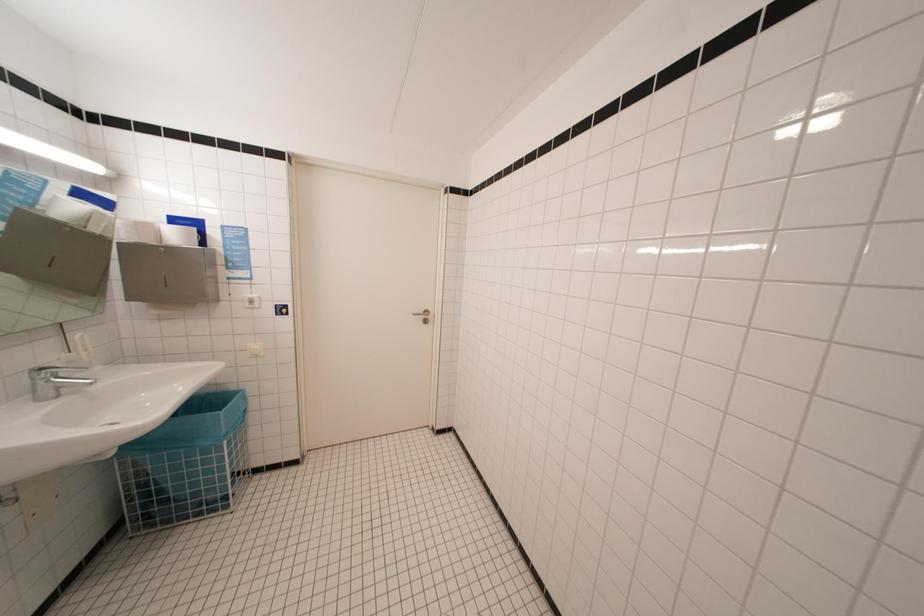
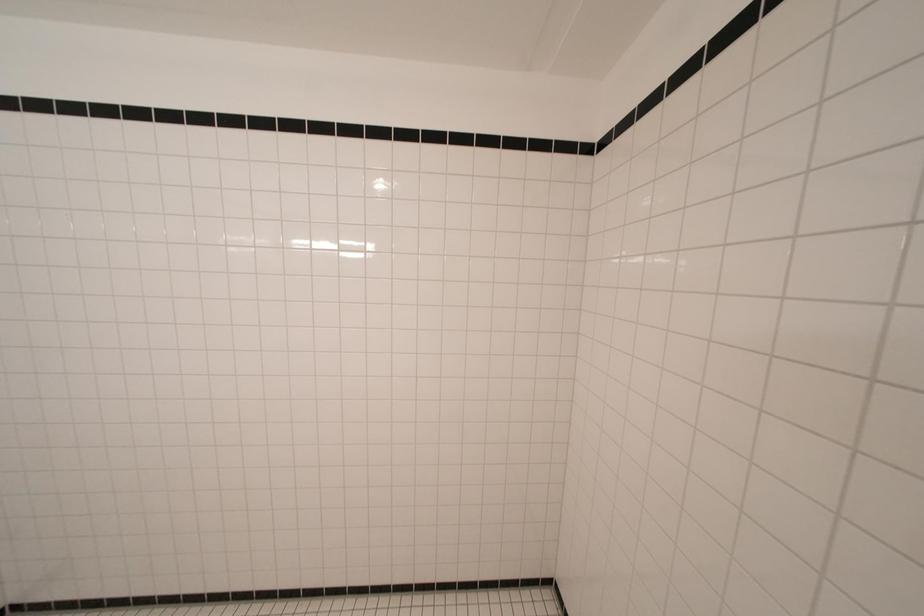
Question: The first image is from the beginning of the video and the second image is from the end. How did the camera likely rotate when shooting the video?

Choices:
 (A) Left
 (B) Right
 (C) Up
 (D) Down

Answer: (B)